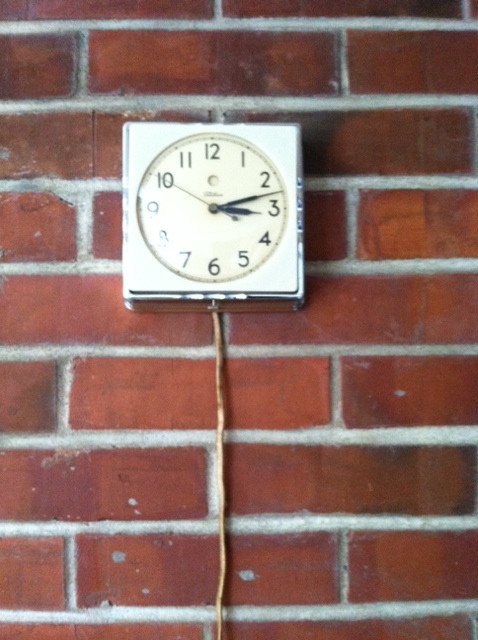
Identify the location of wall. (287, 393).